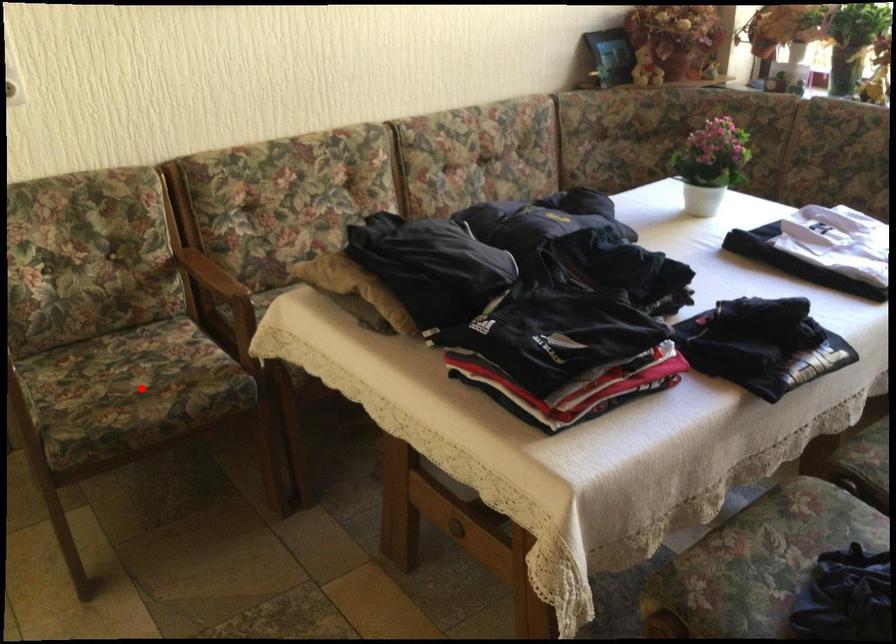
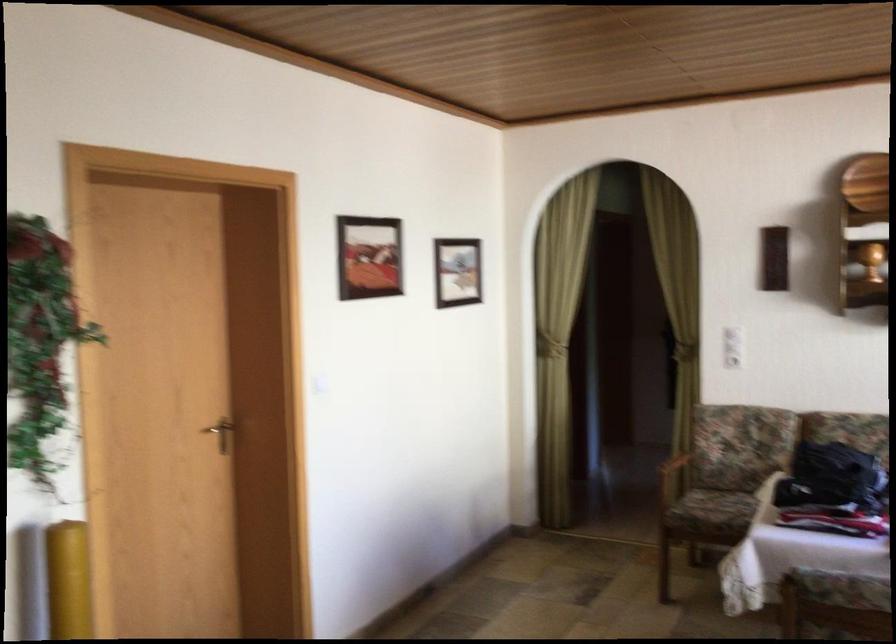
Find the pixel in the second image that matches the highlighted location in the first image.

(725, 507)